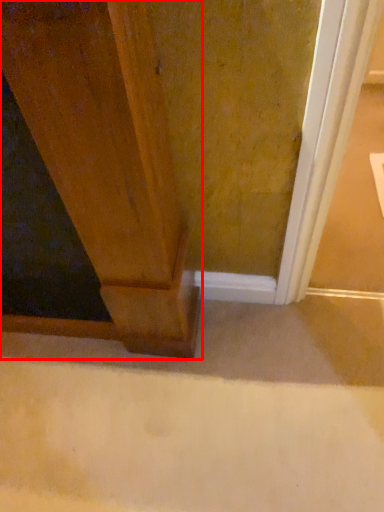
Question: From the image's perspective, where is door (annotated by the red box) located in relation to concrete in the image?

Choices:
 (A) below
 (B) above

Answer: (B)